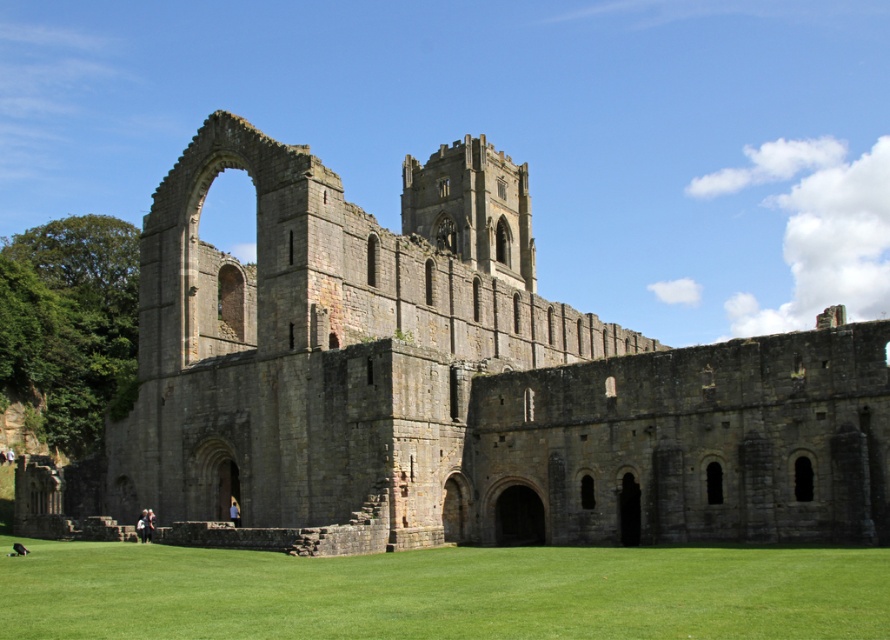
Question: From the image, what is the correct spatial relationship of gray stone monastery at center in relation to green grass at lower center?

Choices:
 (A) below
 (B) above

Answer: (B)

Question: Does gray stone monastery at center have a smaller size compared to green grass at lower center?

Choices:
 (A) yes
 (B) no

Answer: (B)

Question: Does gray stone monastery at center lie behind green grass at lower center?

Choices:
 (A) no
 (B) yes

Answer: (B)

Question: Which point appears closest to the camera in this image?

Choices:
 (A) (488, 360)
 (B) (20, 605)

Answer: (B)

Question: Among these objects, which one is farthest from the camera?

Choices:
 (A) gray stone monastery at center
 (B) green grass at lower center

Answer: (A)